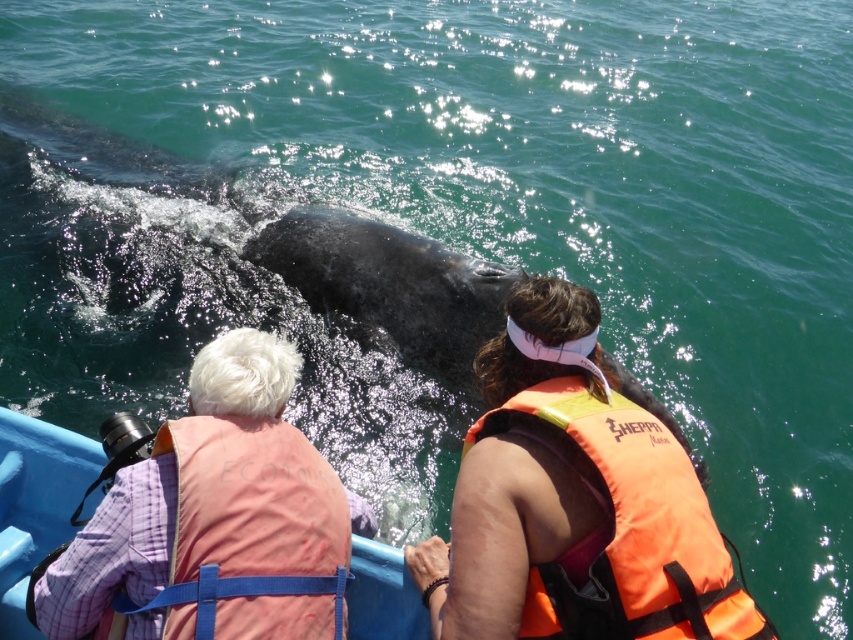
Is pink fabric life vest at left positioned behind pink fabric life jacket at upper left?

Yes, pink fabric life vest at left is further from the viewer.

Where is `pink fabric life vest at left`? pink fabric life vest at left is located at coordinates (215, 518).

Who is lower down, pink fabric life vest at left or orange fabric life jacket at center?

Positioned lower is orange fabric life jacket at center.

Who is more forward, (115, 593) or (618, 525)?

Point (618, 525)

Is point (234, 618) positioned in front of point (585, 452)?

Yes, point (234, 618) is in front of point (585, 452).

This screenshot has height=640, width=853. Find the location of `pink fabric life vest at left`. pink fabric life vest at left is located at coordinates (215, 518).

Which of these two, orange fabric life jacket at center or pink fabric life jacket at upper left, stands shorter?

With less height is pink fabric life jacket at upper left.

What do you see at coordinates (627, 528) in the screenshot?
I see `orange fabric life jacket at center` at bounding box center [627, 528].

You are a GUI agent. You are given a task and a screenshot of the screen. Output one action in this format:
    pyautogui.click(x=<x>, y=<y>)
    Task: Click on the orange fabric life jacket at center
    
    Given the screenshot: What is the action you would take?
    pyautogui.click(x=627, y=528)